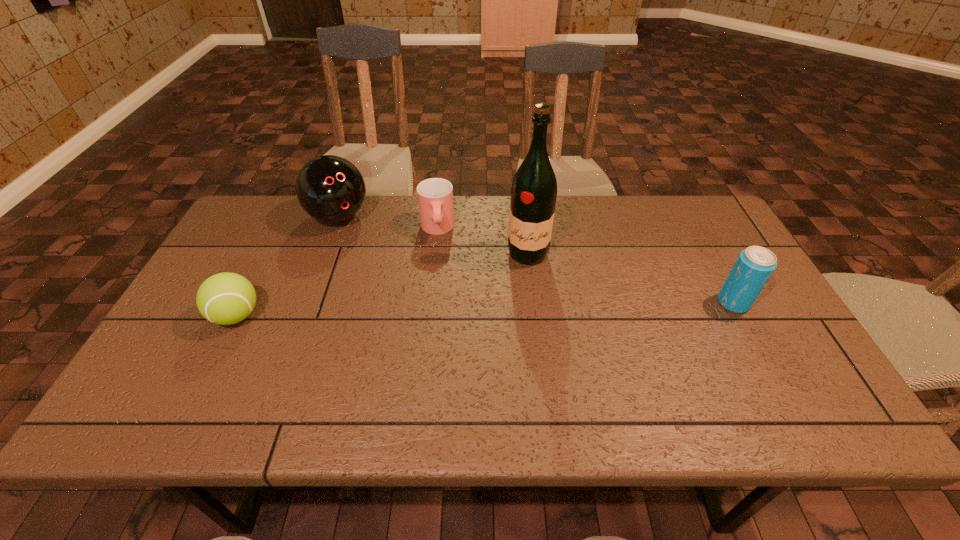
Where is `free space on the desktop that is between the leftmost object and the soda can and is positioned on the front-facing side of the tallest object`? This screenshot has height=540, width=960. free space on the desktop that is between the leftmost object and the soda can and is positioned on the front-facing side of the tallest object is located at coordinates (519, 308).

Identify the location of vacant space on the desktop that is between the tennis ball and the third tallest object and is positioned on the side of the third object from left to right with the handle. This screenshot has width=960, height=540. (446, 310).

Where is `vacant space on the desktop that is between the tennis ball and the soda can and is positioned on the surface of the second object from left to right near the finger holes`? The height and width of the screenshot is (540, 960). vacant space on the desktop that is between the tennis ball and the soda can and is positioned on the surface of the second object from left to right near the finger holes is located at coordinates (x=416, y=311).